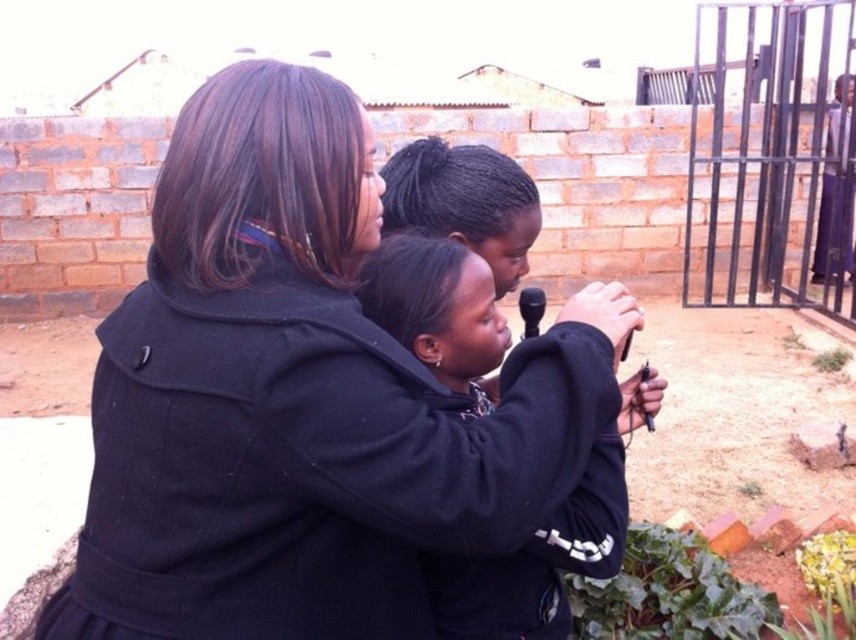
You are standing in a park and see the metallic gate at right. If you want to exit the park, which direction should you walk relative to the gate?

The metallic gate at right is located at point (770,157), so you should walk towards the right side of the park to reach the gate.

You are a photographer positioned at the back of the scene. You want to take a photo of the black wool coat at center and the metallic gate at right. Which object should you focus on first to ensure both are in the frame?

The black wool coat at center is below metallic gate at right, so you should focus on the metallic gate at right first to ensure both are in the frame.